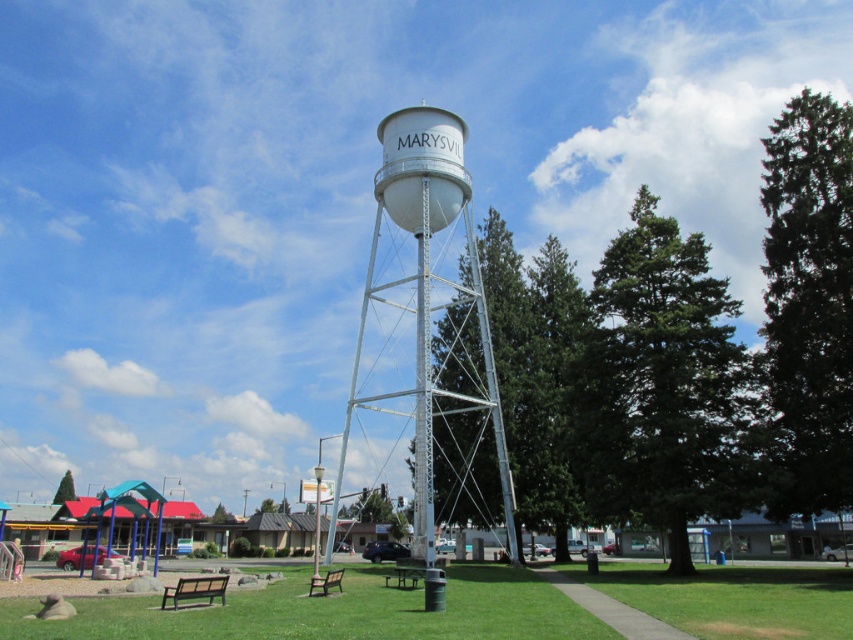
Does white metallic water tower at center appear over brown wooden picnic table at center?

Yes.

Is white metallic water tower at center wider than brown wooden picnic table at center?

Indeed, white metallic water tower at center has a greater width compared to brown wooden picnic table at center.

Does point (467, 460) lie in front of point (418, 563)?

No.

Identify the location of white metallic water tower at center. click(425, 337).